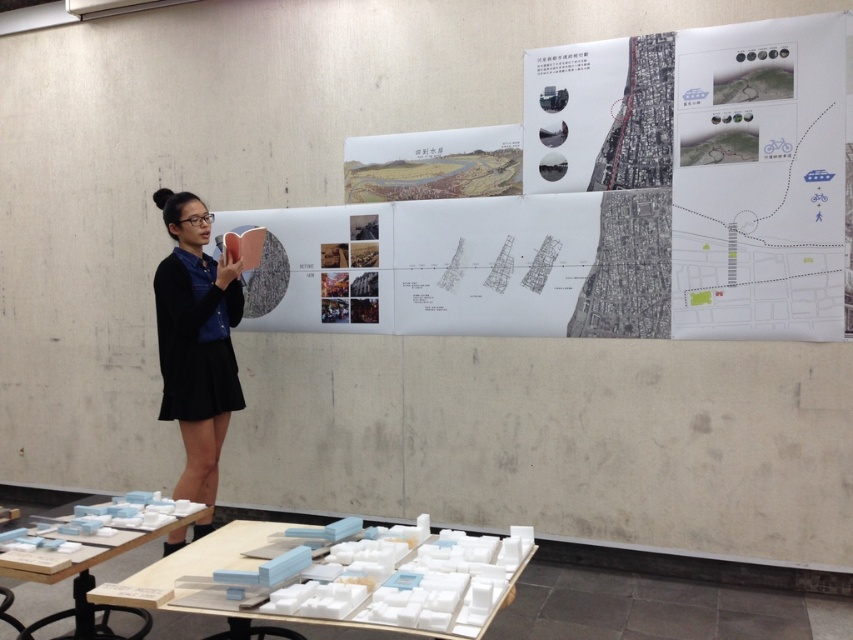
Is point (828, 214) closer to viewer compared to point (456, 620)?

No, it is behind (456, 620).

Who is positioned more to the left, white paper map at center or white foam blocks at lower center?

Positioned to the left is white foam blocks at lower center.

Image resolution: width=853 pixels, height=640 pixels. Identify the location of white paper map at center. (602, 202).

Does point (769, 285) come closer to viewer compared to point (126, 618)?

That is False.

Which is above, white paper map at center or white plastic table at lower left?

white paper map at center

The image size is (853, 640). I want to click on white paper map at center, so click(x=602, y=202).

Between point (172, 353) and point (86, 636), which one is positioned in front?

Point (86, 636) is in front.

Locate an element on the screen. The height and width of the screenshot is (640, 853). black matte dress at center is located at coordinates (196, 340).